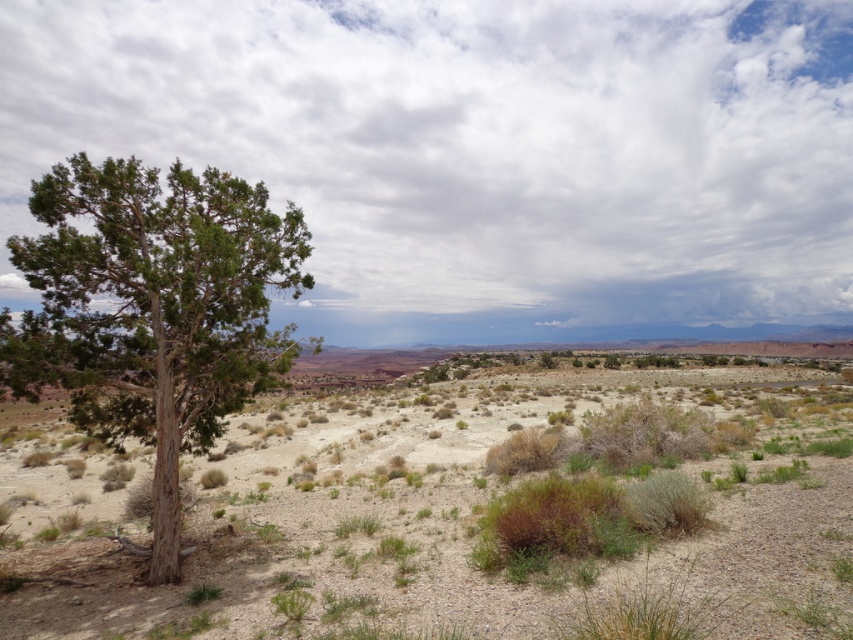
Question: Is green shrubbery at center smaller than green textured tree at left?

Choices:
 (A) yes
 (B) no

Answer: (B)

Question: Observing the image, what is the correct spatial positioning of green shrubbery at center in reference to green textured tree at left?

Choices:
 (A) left
 (B) right

Answer: (B)

Question: Which object is closer to the camera taking this photo?

Choices:
 (A) green textured tree at left
 (B) green shrubbery at center

Answer: (B)

Question: Which object appears closest to the camera in this image?

Choices:
 (A) green shrubbery at center
 (B) green textured tree at left

Answer: (A)

Question: Is green shrubbery at center further to camera compared to green textured tree at left?

Choices:
 (A) no
 (B) yes

Answer: (A)